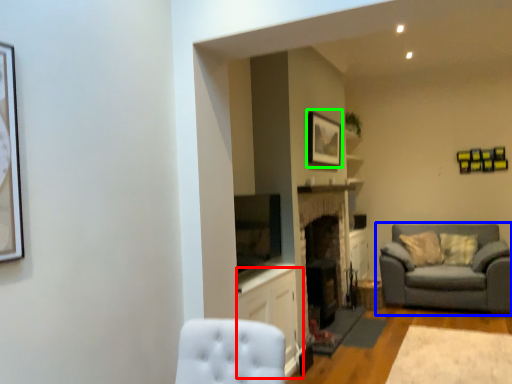
Question: Estimate the real-world distances between objects in this image. Which object is closer to cabinetry (highlighted by a red box), studio couch (highlighted by a blue box) or picture frame (highlighted by a green box)?

Choices:
 (A) studio couch
 (B) picture frame

Answer: (B)